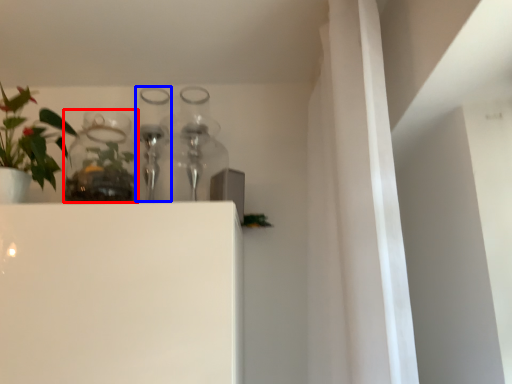
Question: Which of the following is the farthest to the observer, glass vase (highlighted by a red box) or bottle (highlighted by a blue box)?

Choices:
 (A) glass vase
 (B) bottle

Answer: (B)